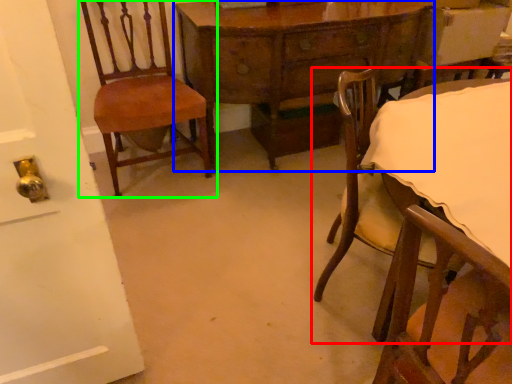
Question: Which object is positioned farthest from chair (highlighted by a red box)? Select from table (highlighted by a blue box) and chair (highlighted by a green box).

Choices:
 (A) table
 (B) chair

Answer: (B)